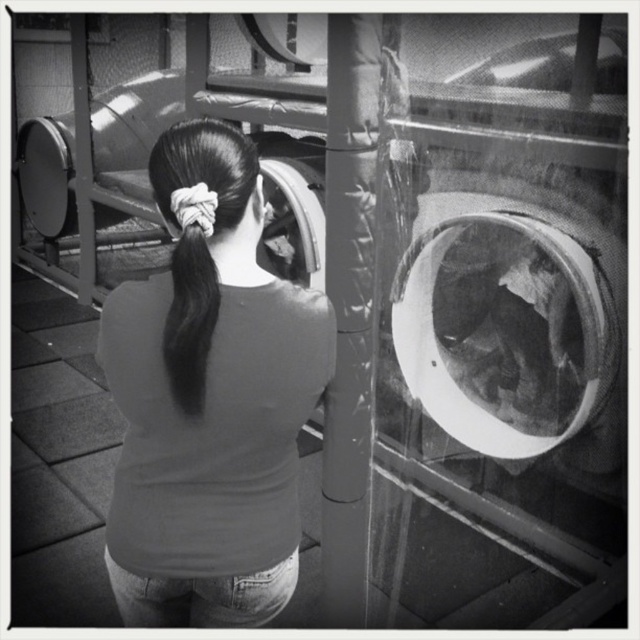
Does smooth gray shirt at center come behind black matte hair at center?

Yes, smooth gray shirt at center is behind black matte hair at center.

Which is behind, point (141, 496) or point (180, 298)?

The point (141, 496) is more distant.

Who is more forward, (282, 563) or (246, 200)?

Point (246, 200) is in front.

Where is `smooth gray shirt at center`? Image resolution: width=640 pixels, height=640 pixels. smooth gray shirt at center is located at coordinates 209,400.

Can you confirm if smooth gray shirt at center is positioned below black silky hair at center?

Yes.

Who is more forward, (198, 300) or (204, 323)?

Point (198, 300) is in front.

This screenshot has width=640, height=640. Identify the location of smooth gray shirt at center. (209, 400).

Does black matte hair at center have a lesser height compared to black silky hair at center?

Correct, black matte hair at center is not as tall as black silky hair at center.

Is black matte hair at center wider than black silky hair at center?

Yes, black matte hair at center is wider than black silky hair at center.

Between point (205, 333) and point (182, 298), which one is positioned behind?

The point (182, 298) is behind.

This screenshot has height=640, width=640. Find the location of `black matte hair at center`. black matte hair at center is located at coordinates (204, 166).